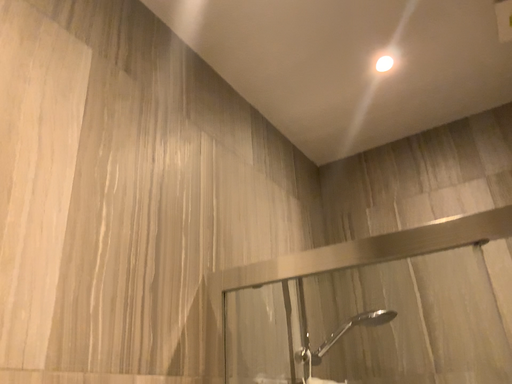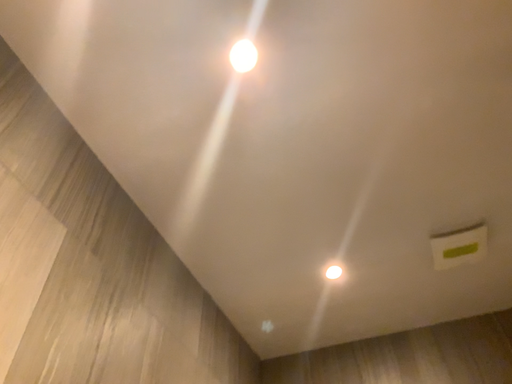
Question: Which way did the camera rotate in the video?

Choices:
 (A) rotated upward
 (B) rotated downward

Answer: (A)